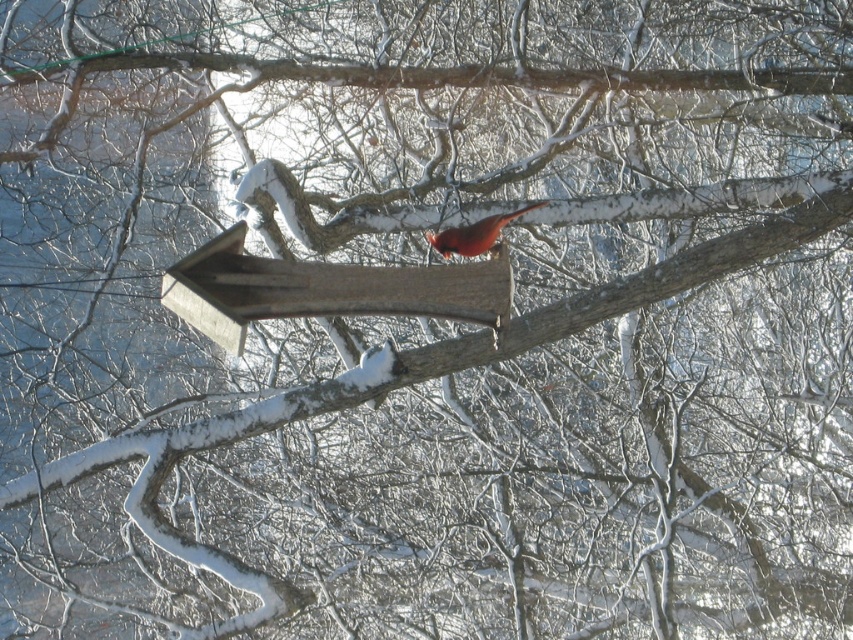
You are a birdwatcher trying to capture a photo of the matte red bird at center. You notice the wooden bird feeder at center is in the way. Can you estimate if the bird feeder is wider than the bird?

The wooden bird feeder at center is wider than the matte red bird at center, so it might block the view of the bird in your photo.

You are a birdwatcher trying to photograph the matte red bird at center. You notice a wooden bird feeder at center nearby. Which object is positioned higher in the image?

The matte red bird at center is higher than the wooden bird feeder at center because the wooden bird feeder at center is located below it.

You are a bird looking for a place to land. You see a wooden bird feeder at center and a matte red bird at center. Which one is closer to you?

The wooden bird feeder at center is closer to the viewer than the matte red bird at center, so the wooden bird feeder at center is closer.